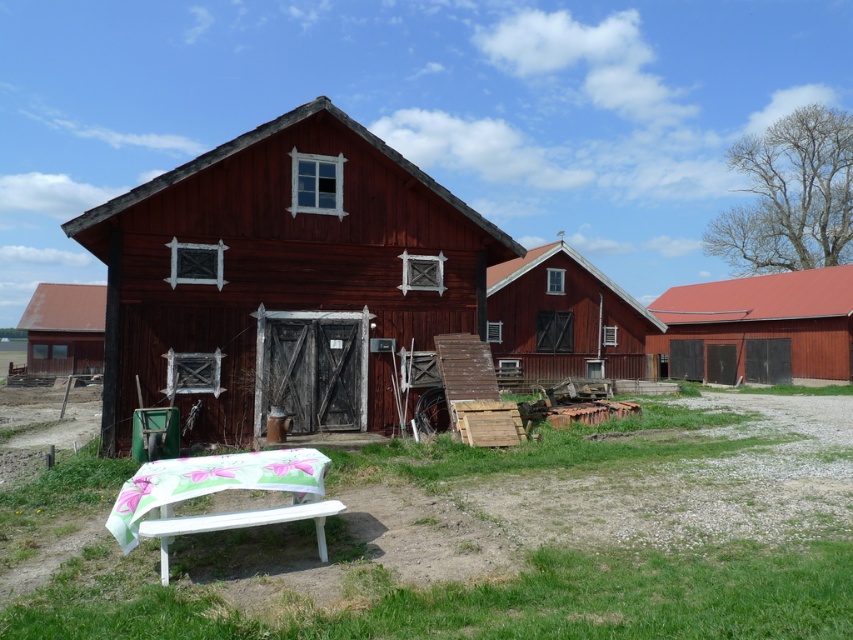
You are standing at the point labeled as point (x=218, y=490) in the image. What object is located at that position?

The point (x=218, y=490) indicates a white painted wood park bench at lower left.

You are planning to set up a tent in the farm area shown. The smooth wooden barn at center and the white painted wood park bench at lower left are in your view. Considering their positions, which object is closer to the ground?

The white painted wood park bench at lower left is closer to the ground because the smooth wooden barn at center is located above it.

In the scene shown: You are planning to set up a picnic area between the smooth wooden barn at center and the smooth wooden hut at center. Which structure should you place your blanket closer to if you want it to be closer to the barn?

You should place your blanket closer to the smooth wooden barn at center because it is positioned on the left side of the smooth wooden hut at center, making it the nearest structure to the picnic area.